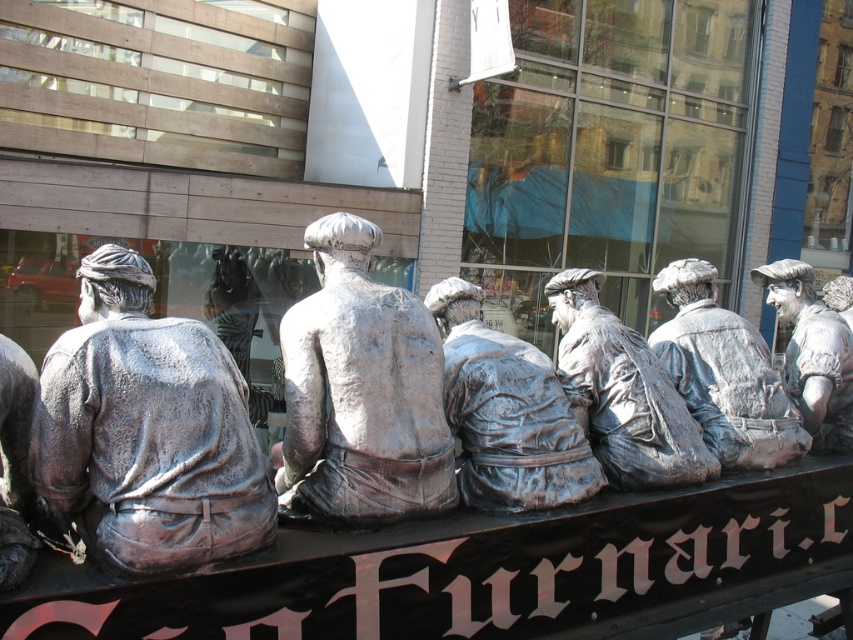
Question: Among these objects, which one is farthest from the camera?

Choices:
 (A) silver textured statue at center
 (B) silver metallic statue at center
 (C) clear glass window at center

Answer: (C)

Question: Which of these objects is positioned farthest from the shiny silver statue at left?

Choices:
 (A) polished silver statue at center
 (B) bronze statue at center
 (C) clear glass window at center

Answer: (C)

Question: Among these points, which one is nearest to the camera?

Choices:
 (A) (454, 502)
 (B) (793, 458)
 (C) (138, 360)
 (D) (828, 371)

Answer: (C)

Question: Considering the relative positions of shiny silver statue at left and bronze statue at center in the image provided, where is shiny silver statue at left located with respect to bronze statue at center?

Choices:
 (A) left
 (B) right

Answer: (A)

Question: Is the position of silver metallic statue at center more distant than that of polished silver statue at right?

Choices:
 (A) no
 (B) yes

Answer: (A)

Question: Is bronze statue at center above silver textured statue at center?

Choices:
 (A) yes
 (B) no

Answer: (A)